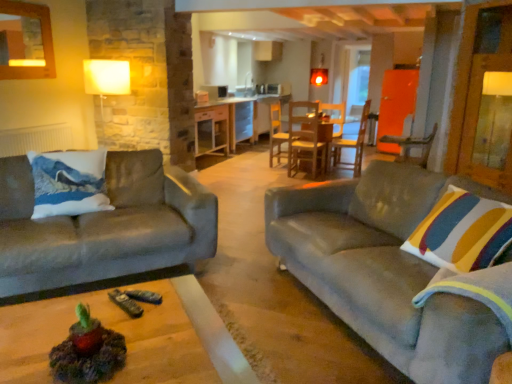
Question: Can you confirm if wooden table at center is bigger than velvet gray couch at left, the 1th studio couch when ordered from left to right?

Choices:
 (A) yes
 (B) no

Answer: (B)

Question: Can you confirm if wooden table at center is wider than velvet gray couch at left, the 1th studio couch when ordered from left to right?

Choices:
 (A) no
 (B) yes

Answer: (A)

Question: From the image's perspective, is wooden table at center under velvet gray couch at left, the 1th studio couch when ordered from left to right?

Choices:
 (A) no
 (B) yes

Answer: (A)

Question: Considering the relative positions of wooden table at center and velvet gray couch at left, the 1th studio couch when ordered from left to right, in the image provided, is wooden table at center to the right of velvet gray couch at left, the 1th studio couch when ordered from left to right, from the viewer's perspective?

Choices:
 (A) yes
 (B) no

Answer: (A)

Question: Is wooden table at center positioned far away from velvet gray couch at left, arranged as the 2th studio couch when viewed from the right?

Choices:
 (A) yes
 (B) no

Answer: (A)

Question: Does wooden table at center appear on the left side of velvet gray couch at left, arranged as the 2th studio couch when viewed from the right?

Choices:
 (A) yes
 (B) no

Answer: (B)

Question: Can you confirm if velvet gray couch at left, the 1th studio couch when ordered from left to right, is smaller than velvet grey couch at right, acting as the 1th studio couch starting from the right?

Choices:
 (A) yes
 (B) no

Answer: (A)

Question: Is velvet gray couch at left, the 1th studio couch when ordered from left to right, closer to the viewer compared to velvet grey couch at right, which ranks as the 2th studio couch in left-to-right order?

Choices:
 (A) no
 (B) yes

Answer: (A)

Question: Could you tell me if velvet gray couch at left, arranged as the 2th studio couch when viewed from the right, is facing velvet grey couch at right, acting as the 1th studio couch starting from the right?

Choices:
 (A) no
 (B) yes

Answer: (A)

Question: Is velvet gray couch at left, arranged as the 2th studio couch when viewed from the right, surrounding velvet grey couch at right, acting as the 1th studio couch starting from the right?

Choices:
 (A) no
 (B) yes

Answer: (A)

Question: Is velvet gray couch at left, the 1th studio couch when ordered from left to right, behind velvet grey couch at right, acting as the 1th studio couch starting from the right?

Choices:
 (A) no
 (B) yes

Answer: (B)

Question: Considering the relative sizes of velvet gray couch at left, arranged as the 2th studio couch when viewed from the right, and velvet grey couch at right, which ranks as the 2th studio couch in left-to-right order, in the image provided, is velvet gray couch at left, arranged as the 2th studio couch when viewed from the right, taller than velvet grey couch at right, which ranks as the 2th studio couch in left-to-right order,?

Choices:
 (A) yes
 (B) no

Answer: (B)

Question: Does wooden chair at right, placed as the 2th chair when sorted from back to front, have a lesser width compared to white matte radiator at left?

Choices:
 (A) no
 (B) yes

Answer: (A)